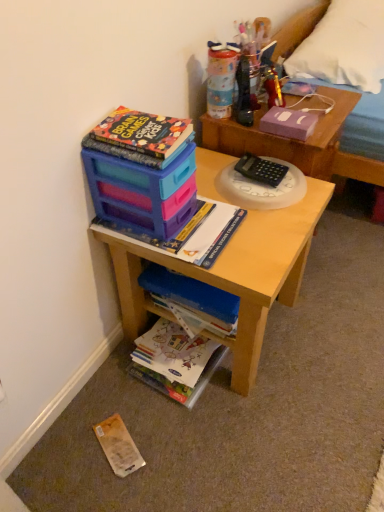
The image size is (384, 512). Find the location of `vacant space in front of black plastic calculator at center, the 1th stationery ordered from the bottom`. vacant space in front of black plastic calculator at center, the 1th stationery ordered from the bottom is located at coordinates (267, 220).